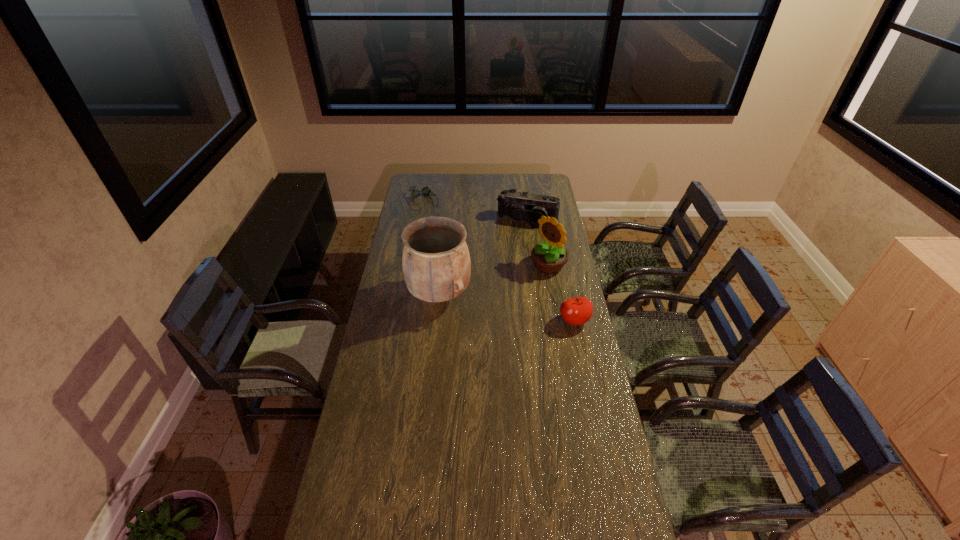
At what (x,y) coordinates should I click in order to perform the action: click on vacant position in the image that satisfies the following two spatial constraints: 1. on the front side of the spectacles; 2. on the right side of the second tallest object. Please return your answer as a coordinate pair (x, y). This screenshot has height=540, width=960. Looking at the image, I should click on (413, 265).

Locate an element on the screen. The width and height of the screenshot is (960, 540). free spot that satisfies the following two spatial constraints: 1. on the front side of the shortest object; 2. on the left side of the urn is located at coordinates (407, 294).